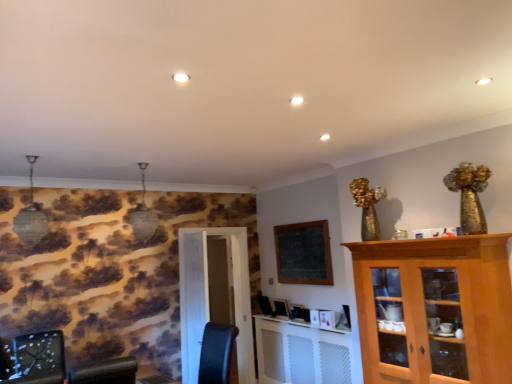
The width and height of the screenshot is (512, 384). Describe the element at coordinates (304, 253) in the screenshot. I see `wooden bulletin board at upper center` at that location.

What is the approximate width of white glossy door at center?

12.57 inches.

Describe the element at coordinates (435, 309) in the screenshot. I see `light brown wooden cabinet at right` at that location.

The width and height of the screenshot is (512, 384). What do you see at coordinates (152, 376) in the screenshot?
I see `wooden table at lower center` at bounding box center [152, 376].

You are a GUI agent. You are given a task and a screenshot of the screen. Output one action in this format:
    pyautogui.click(x=<x>, y=<y>)
    Task: Click on the white mesh radiator at lower center
    
    Given the screenshot: What is the action you would take?
    pyautogui.click(x=302, y=353)

Consider the image. What's the angular difference between white mesh radiator at lower center and wooden bulletin board at upper center's facing directions?

The facing directions of white mesh radiator at lower center and wooden bulletin board at upper center are 0.000909 degrees apart.

Based on the photo, from the image's perspective, is white mesh radiator at lower center over wooden bulletin board at upper center?

No.

Where is `computer desk in front of the wooden bulletin board at upper center`? The image size is (512, 384). computer desk in front of the wooden bulletin board at upper center is located at coordinates (302, 353).

Identify the location of door on the left side of light brown wooden cabinet at right. (215, 296).

Who is smaller, light brown wooden cabinet at right or white glossy door at center?

Smaller between the two is white glossy door at center.

From the image's perspective, which one is positioned lower, light brown wooden cabinet at right or white glossy door at center?

white glossy door at center.

Is white glossy door at center surrounded by light brown wooden cabinet at right?

No, white glossy door at center is not inside light brown wooden cabinet at right.

Is white mesh radiator at lower center to the left or to the right of white glossy door at center in the image?

From the image, it's evident that white mesh radiator at lower center is to the right of white glossy door at center.

Is white mesh radiator at lower center next to white glossy door at center?

No, white mesh radiator at lower center is not beside white glossy door at center.

Which is in front, point (313, 376) or point (209, 250)?

The point (313, 376) is more forward.

In the scene shown: From the image's perspective, which one is positioned higher, white mesh radiator at lower center or white glossy door at center?

white glossy door at center appears higher in the image.

Can you tell me how much white glossy door at center and wooden table at lower center differ in facing direction?

The angular difference between white glossy door at center and wooden table at lower center is 90.4 degrees.

Who is taller, white glossy door at center or wooden table at lower center?

With more height is white glossy door at center.

Considering the sizes of objects white glossy door at center and wooden table at lower center in the image provided, who is thinner, white glossy door at center or wooden table at lower center?

wooden table at lower center.

Would you consider white glossy door at center to be distant from wooden table at lower center?

Indeed, white glossy door at center is not near wooden table at lower center.

How many degrees apart are the facing directions of wooden bulletin board at upper center and light brown wooden cabinet at right?

The angle between the facing direction of wooden bulletin board at upper center and the facing direction of light brown wooden cabinet at right is 0.338 degrees.

Is wooden bulletin board at upper center spatially inside light brown wooden cabinet at right, or outside of it?

wooden bulletin board at upper center exists outside the volume of light brown wooden cabinet at right.

Which object is wider, wooden bulletin board at upper center or light brown wooden cabinet at right?

light brown wooden cabinet at right is wider.

From the picture: Can you tell me how much wooden table at lower center and white mesh radiator at lower center differ in facing direction?

The facing directions of wooden table at lower center and white mesh radiator at lower center are 0.526 degrees apart.

Does wooden table at lower center have a larger size compared to white mesh radiator at lower center?

Incorrect, wooden table at lower center is not larger than white mesh radiator at lower center.

Considering the positions of objects wooden table at lower center and white mesh radiator at lower center in the image provided, who is more to the left, wooden table at lower center or white mesh radiator at lower center?

wooden table at lower center.

How far apart are white glossy door at center and white mesh radiator at lower center?

white glossy door at center is 35.37 inches from white mesh radiator at lower center.

Is point (225, 265) behind point (333, 362)?

Yes.

Is white glossy door at center at the left side of white mesh radiator at lower center?

Indeed, white glossy door at center is positioned on the left side of white mesh radiator at lower center.

Which object is wider, white glossy door at center or white mesh radiator at lower center?

white glossy door at center is wider.

Locate an element on the screen. Image resolution: width=512 pixels, height=384 pixels. computer desk lying on the right of wooden bulletin board at upper center is located at coordinates (302, 353).

You are a GUI agent. You are given a task and a screenshot of the screen. Output one action in this format:
    pyautogui.click(x=<x>, y=<y>)
    Task: Click on the door behind the light brown wooden cabinet at right
    
    Given the screenshot: What is the action you would take?
    pyautogui.click(x=215, y=296)

When comparing their distances from light brown wooden cabinet at right, does white glossy door at center or wooden bulletin board at upper center seem closer?

Based on the image, wooden bulletin board at upper center appears to be nearer to light brown wooden cabinet at right.

Based on their spatial positions, is light brown wooden cabinet at right or wooden bulletin board at upper center closer to wooden table at lower center?

Based on the image, wooden bulletin board at upper center appears to be nearer to wooden table at lower center.

When comparing their distances from white glossy door at center, does light brown wooden cabinet at right or wooden table at lower center seem closer?

wooden table at lower center is positioned closer to the anchor white glossy door at center.

Estimate the real-world distances between objects in this image. Which object is further from white mesh radiator at lower center, wooden bulletin board at upper center or wooden table at lower center?

Based on the image, wooden table at lower center appears to be further to white mesh radiator at lower center.

When comparing their distances from wooden table at lower center, does wooden bulletin board at upper center or light brown wooden cabinet at right seem further?

light brown wooden cabinet at right lies further to wooden table at lower center than the other object.

Which object lies nearer to the anchor point white mesh radiator at lower center, wooden bulletin board at upper center or white glossy door at center?

Based on the image, wooden bulletin board at upper center appears to be nearer to white mesh radiator at lower center.

When comparing their distances from light brown wooden cabinet at right, does wooden bulletin board at upper center or white glossy door at center seem closer?

wooden bulletin board at upper center is closer to light brown wooden cabinet at right.

Which object lies further to the anchor point wooden bulletin board at upper center, light brown wooden cabinet at right or white mesh radiator at lower center?

Based on the image, light brown wooden cabinet at right appears to be further to wooden bulletin board at upper center.

The height and width of the screenshot is (384, 512). In order to click on bulletin board located between wooden table at lower center and white glossy door at center in the depth direction in this screenshot , I will do `click(304, 253)`.

The width and height of the screenshot is (512, 384). What are the coordinates of `bulletin board situated between wooden table at lower center and white mesh radiator at lower center from left to right` in the screenshot? It's located at (304, 253).

Where is `computer desk between light brown wooden cabinet at right and wooden bulletin board at upper center along the z-axis`? Image resolution: width=512 pixels, height=384 pixels. computer desk between light brown wooden cabinet at right and wooden bulletin board at upper center along the z-axis is located at coordinates (302, 353).

Find the location of `table positioned between light brown wooden cabinet at right and wooden bulletin board at upper center from near to far`. table positioned between light brown wooden cabinet at right and wooden bulletin board at upper center from near to far is located at coordinates [152, 376].